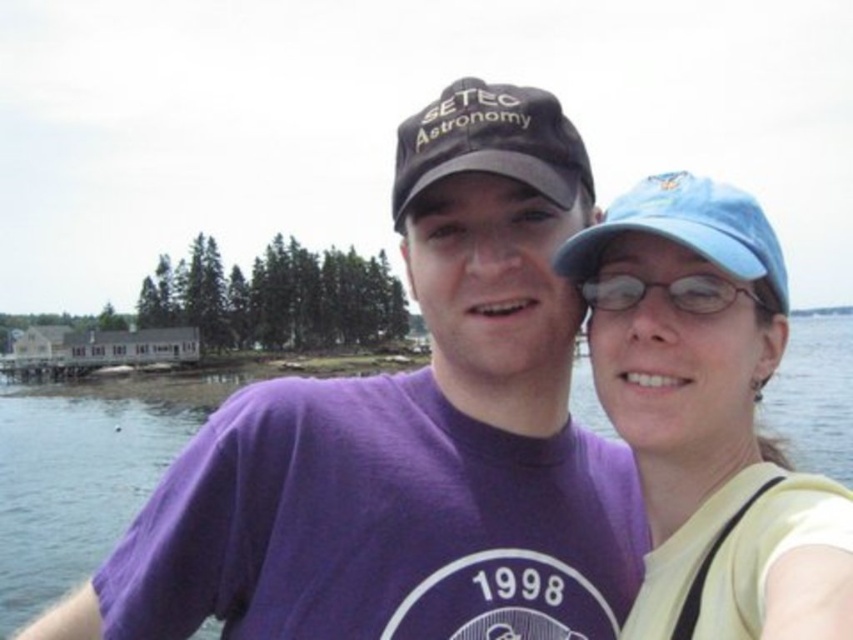
You are a photographer trying to capture a closeup shot of the blue fabric baseball cap at right and the clear plastic glasses at upper center. Which object should you zoom in on to ensure both fit in the frame without cropping?

The clear plastic glasses at upper center are smaller in width compared to the blue fabric baseball cap at right. To ensure both fit in the frame without cropping, you should zoom in on the larger object, which is the blue fabric baseball cap at right.

Based on the photo, you are a photographer trying to capture a clear shot of the matte blue cap at upper right and the transparent water at center. Which object is closer to the camera, based on their sizes in the image?

The matte blue cap at upper right is closer to the camera because it appears smaller than the transparent water at center, which is farther away and thus larger in the image.